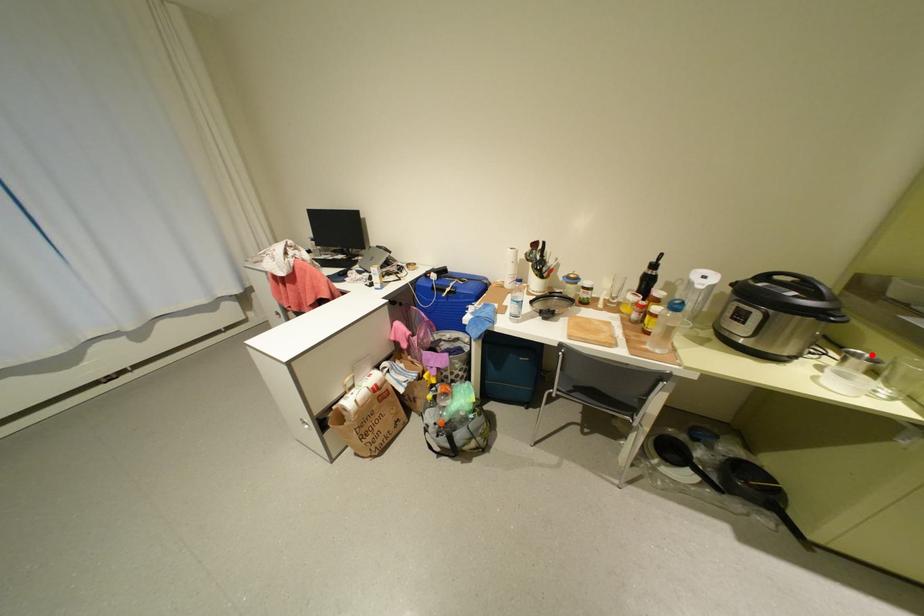
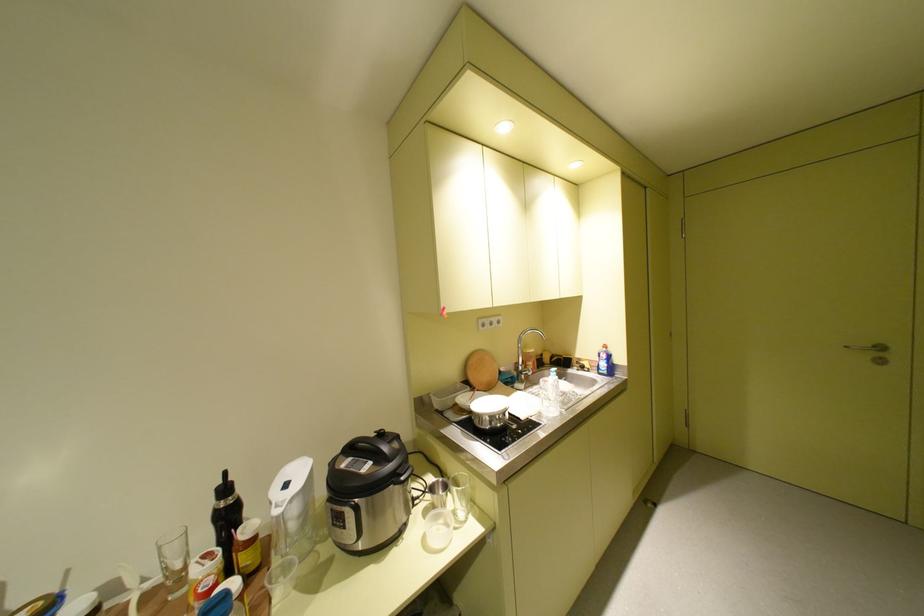
In the second image, find the point that corresponds to the highlighted location in the first image.

(450, 482)